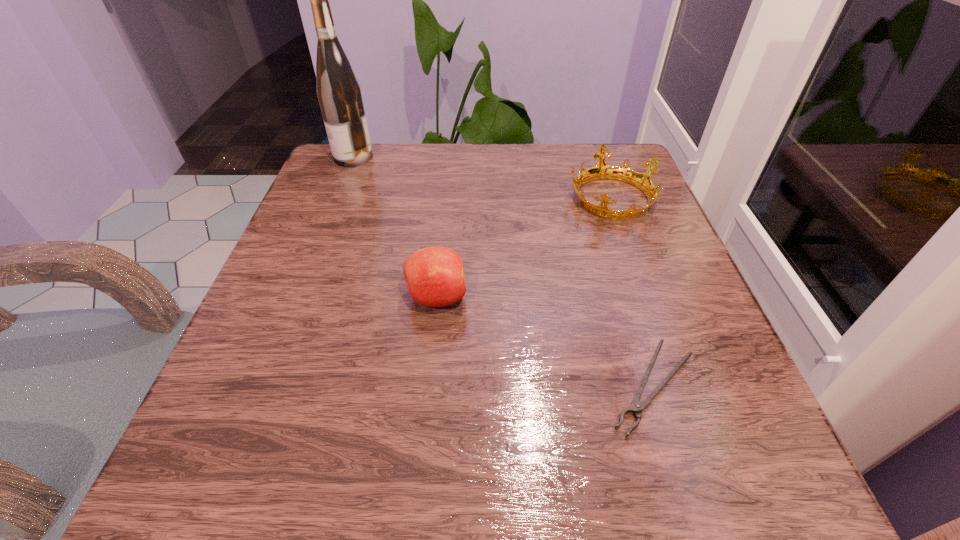
Identify the location of vacant position located on the left of the second shortest object. The image size is (960, 540). (402, 197).

This screenshot has height=540, width=960. I want to click on vacant space situated on the left of the tongs, so click(x=389, y=386).

The image size is (960, 540). Identify the location of wine bottle present at the far edge. (338, 91).

At what (x,y) coordinates should I click in order to perform the action: click on crown positioned at the far edge. Please return your answer as a coordinate pair (x, y). Looking at the image, I should click on (642, 181).

This screenshot has height=540, width=960. I want to click on object at the near edge, so click(x=637, y=406).

At what (x,y) coordinates should I click in order to perform the action: click on object that is at the left edge. Please return your answer as a coordinate pair (x, y). The width and height of the screenshot is (960, 540). Looking at the image, I should click on (338, 91).

At what (x,y) coordinates should I click in order to perform the action: click on crown at the right edge. Please return your answer as a coordinate pair (x, y). Looking at the image, I should click on (642, 181).

At what (x,y) coordinates should I click in order to perform the action: click on tongs located at the right edge. Please return your answer as a coordinate pair (x, y). The width and height of the screenshot is (960, 540). Looking at the image, I should click on (637, 406).

Where is `object at the far left corner`? The image size is (960, 540). object at the far left corner is located at coordinates (338, 91).

The image size is (960, 540). Identify the location of object that is at the far right corner. (642, 181).